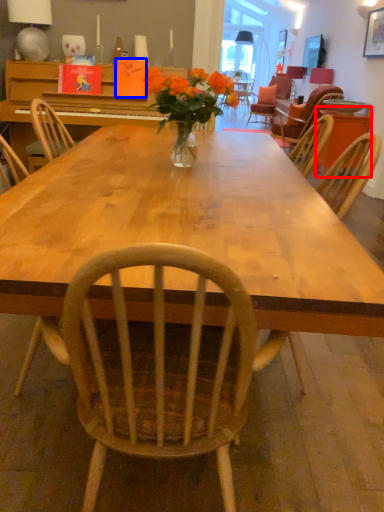
Question: Which object is closer to the camera taking this photo, table (highlighted by a red box) or book (highlighted by a blue box)?

Choices:
 (A) table
 (B) book

Answer: (B)